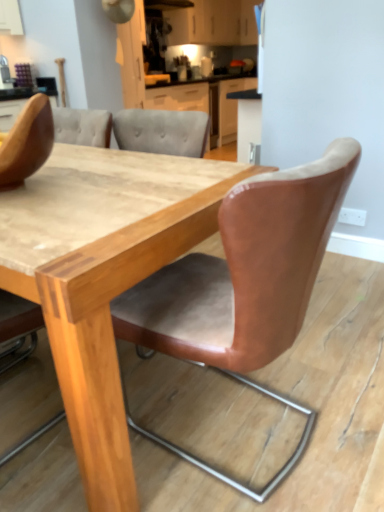
Where is `brown leather chair at upper left, arranged as the second chair when viewed from the right`? brown leather chair at upper left, arranged as the second chair when viewed from the right is located at coordinates (27, 142).

In the scene shown: What is the approximate width of wooden table at center?

The width of wooden table at center is 1.00 meters.

At what (x,y) coordinates should I click in order to perform the action: click on brown leather chair at upper left, which is counted as the 1th chair, starting from the left. Please return your answer as a coordinate pair (x, y). This screenshot has height=512, width=384. Looking at the image, I should click on (27, 142).

Which is closer, (99, 465) or (2, 163)?

Clearly, point (99, 465) is closer to the camera than point (2, 163).

Can you tell me how much wooden table at center and brown leather chair at upper left, arranged as the second chair when viewed from the right, differ in facing direction?

The angular difference between wooden table at center and brown leather chair at upper left, arranged as the second chair when viewed from the right, is 0.247 degrees.

Who is bigger, wooden table at center or brown leather chair at upper left, which is counted as the 1th chair, starting from the left?

wooden table at center.

Are wooden table at center and brown leather chair at upper left, which is counted as the 1th chair, starting from the left, beside each other?

No.

Identify the location of cabinetry behind the leather-like tan chair at center, positioned as the second chair in left-to-right order. (214, 23).

In the scene shown: Does leather-like tan chair at center, positioned as the second chair in left-to-right order, have a smaller size compared to matte white cabinets at upper center?

Correct, leather-like tan chair at center, positioned as the second chair in left-to-right order, occupies less space than matte white cabinets at upper center.

From a real-world perspective, is leather-like tan chair at center, positioned as the second chair in left-to-right order, positioned above or below matte white cabinets at upper center?

leather-like tan chair at center, positioned as the second chair in left-to-right order, is situated lower than matte white cabinets at upper center in the real world.

Which is more to the right, leather-like tan chair at center, positioned as the second chair in left-to-right order, or matte white cabinets at upper center?

matte white cabinets at upper center is more to the right.

In the scene shown: From a real-world perspective, which object rests below the other?

leather-like tan chair at center, positioned as the second chair in left-to-right order.

Between matte white cabinets at upper center and leather-like tan chair at center, positioned as the second chair in left-to-right order, which one appears on the left side from the viewer's perspective?

leather-like tan chair at center, positioned as the second chair in left-to-right order, is more to the left.

Considering the relative positions of matte white cabinets at upper center and leather-like tan chair at center, the 1th chair in the right-to-left sequence, in the image provided, is matte white cabinets at upper center in front of leather-like tan chair at center, the 1th chair in the right-to-left sequence,?

No, matte white cabinets at upper center is further to the viewer.

Considering the relative positions of leather-like tan chair at center, the 1th chair in the right-to-left sequence, and brown leather chair at upper left, arranged as the second chair when viewed from the right, in the image provided, is leather-like tan chair at center, the 1th chair in the right-to-left sequence, behind brown leather chair at upper left, arranged as the second chair when viewed from the right,?

No, it is not.

From the image's perspective, is leather-like tan chair at center, positioned as the second chair in left-to-right order, below brown leather chair at upper left, which is counted as the 1th chair, starting from the left?

Correct, leather-like tan chair at center, positioned as the second chair in left-to-right order, appears lower than brown leather chair at upper left, which is counted as the 1th chair, starting from the left, in the image.

How many degrees apart are the facing directions of leather-like tan chair at center, the 1th chair in the right-to-left sequence, and brown leather chair at upper left, arranged as the second chair when viewed from the right?

86.4 degrees.

Could you measure the distance between leather-like tan chair at center, positioned as the second chair in left-to-right order, and brown leather chair at upper left, arranged as the second chair when viewed from the right?

They are 25.50 inches apart.

Is leather-like tan chair at center, positioned as the second chair in left-to-right order, at the back of brown leather chair at upper left, arranged as the second chair when viewed from the right?

No, brown leather chair at upper left, arranged as the second chair when viewed from the right, is not facing the opposite direction of leather-like tan chair at center, positioned as the second chair in left-to-right order.

Is brown leather chair at upper left, arranged as the second chair when viewed from the right, thinner than leather-like tan chair at center, the 1th chair in the right-to-left sequence?

Indeed, brown leather chair at upper left, arranged as the second chair when viewed from the right, has a lesser width compared to leather-like tan chair at center, the 1th chair in the right-to-left sequence.

Is brown leather chair at upper left, arranged as the second chair when viewed from the right, far from leather-like tan chair at center, the 1th chair in the right-to-left sequence?

brown leather chair at upper left, arranged as the second chair when viewed from the right, is actually quite close to leather-like tan chair at center, the 1th chair in the right-to-left sequence.

How distant is brown leather chair at upper left, which is counted as the 1th chair, starting from the left, from leather-like tan chair at center, the 1th chair in the right-to-left sequence?

brown leather chair at upper left, which is counted as the 1th chair, starting from the left, is 25.50 inches from leather-like tan chair at center, the 1th chair in the right-to-left sequence.

From a real-world perspective, does leather-like tan chair at center, the 1th chair in the right-to-left sequence, stand above wooden table at center?

Yes.

What are the coordinates of `the 2nd chair to the right of the wooden table at center, starting your count from the anchor` in the screenshot? It's located at (244, 284).

Considering the relative sizes of leather-like tan chair at center, positioned as the second chair in left-to-right order, and wooden table at center in the image provided, is leather-like tan chair at center, positioned as the second chair in left-to-right order, taller than wooden table at center?

Yes.

From a real-world perspective, is matte white cabinets at upper center on top of wooden table at center?

Correct, in the physical world, matte white cabinets at upper center is higher than wooden table at center.

Considering the sizes of matte white cabinets at upper center and wooden table at center in the image, is matte white cabinets at upper center wider or thinner than wooden table at center?

matte white cabinets at upper center is thinner than wooden table at center.

Does matte white cabinets at upper center have a larger size compared to wooden table at center?

Actually, matte white cabinets at upper center might be smaller than wooden table at center.

Considering the points (223, 23) and (52, 283), which point is in front, point (223, 23) or point (52, 283)?

Positioned in front is point (52, 283).

Where is `chair behind the wooden table at center`? Image resolution: width=384 pixels, height=512 pixels. chair behind the wooden table at center is located at coordinates (27, 142).

Where is `cabinetry above the leather-like tan chair at center, the 1th chair in the right-to-left sequence (from a real-world perspective)`? Image resolution: width=384 pixels, height=512 pixels. cabinetry above the leather-like tan chair at center, the 1th chair in the right-to-left sequence (from a real-world perspective) is located at coordinates (214, 23).

Considering their positions, is matte white cabinets at upper center positioned further to brown leather chair at upper left, which is counted as the 1th chair, starting from the left, than leather-like tan chair at center, the 1th chair in the right-to-left sequence?

matte white cabinets at upper center.

When comparing their distances from leather-like tan chair at center, positioned as the second chair in left-to-right order, does wooden table at center or matte white cabinets at upper center seem further?

The object further to leather-like tan chair at center, positioned as the second chair in left-to-right order, is matte white cabinets at upper center.

Based on their spatial positions, is brown leather chair at upper left, which is counted as the 1th chair, starting from the left, or wooden table at center further from matte white cabinets at upper center?

brown leather chair at upper left, which is counted as the 1th chair, starting from the left, is positioned further to the anchor matte white cabinets at upper center.

Which object lies nearer to the anchor point matte white cabinets at upper center, leather-like tan chair at center, positioned as the second chair in left-to-right order, or wooden table at center?

Among the two, wooden table at center is located nearer to matte white cabinets at upper center.

Estimate the real-world distances between objects in this image. Which object is closer to matte white cabinets at upper center, wooden table at center or leather-like tan chair at center, positioned as the second chair in left-to-right order?

wooden table at center is positioned closer to the anchor matte white cabinets at upper center.

Based on their spatial positions, is matte white cabinets at upper center or leather-like tan chair at center, the 1th chair in the right-to-left sequence, further from wooden table at center?

Based on the image, matte white cabinets at upper center appears to be further to wooden table at center.

Looking at the image, which one is located closer to matte white cabinets at upper center, wooden table at center or brown leather chair at upper left, which is counted as the 1th chair, starting from the left?

Among the two, wooden table at center is located nearer to matte white cabinets at upper center.

Based on their spatial positions, is matte white cabinets at upper center or brown leather chair at upper left, which is counted as the 1th chair, starting from the left, closer to wooden table at center?

Among the two, brown leather chair at upper left, which is counted as the 1th chair, starting from the left, is located nearer to wooden table at center.

The width and height of the screenshot is (384, 512). Identify the location of chair located between wooden table at center and leather-like tan chair at center, the 1th chair in the right-to-left sequence, in the left-right direction. (27, 142).

Image resolution: width=384 pixels, height=512 pixels. Find the location of `chair located between leather-like tan chair at center, the 1th chair in the right-to-left sequence, and matte white cabinets at upper center in the depth direction`. chair located between leather-like tan chair at center, the 1th chair in the right-to-left sequence, and matte white cabinets at upper center in the depth direction is located at coordinates (27, 142).

The width and height of the screenshot is (384, 512). I want to click on chair between wooden table at center and matte white cabinets at upper center in the front-back direction, so click(x=27, y=142).

Find the location of a particular element. The width and height of the screenshot is (384, 512). table between leather-like tan chair at center, the 1th chair in the right-to-left sequence, and matte white cabinets at upper center from front to back is located at coordinates (113, 289).